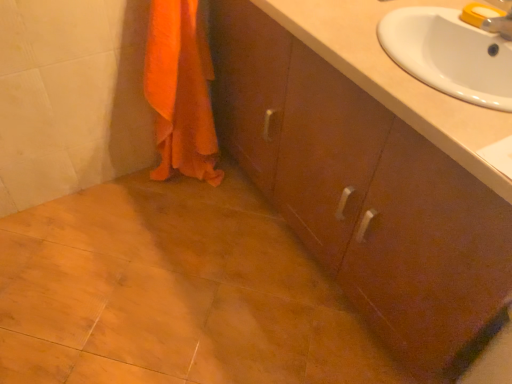
Describe the element at coordinates (181, 91) in the screenshot. The image size is (512, 384). I see `orange fabric towel at lower left` at that location.

The image size is (512, 384). I want to click on white glossy sink at upper right, so (395, 77).

Which of these two, orange fabric towel at lower left or brown wood cabinet at center, is smaller?

With smaller size is orange fabric towel at lower left.

Consider the image. Is orange fabric towel at lower left situated inside brown wood cabinet at center or outside?

orange fabric towel at lower left exists outside the volume of brown wood cabinet at center.

Which object is further away from the camera taking this photo, orange fabric towel at lower left or brown wood cabinet at center?

Positioned behind is orange fabric towel at lower left.

From a real-world perspective, which object rests below the other?

orange fabric towel at lower left.

Can you tell me how much orange fabric towel at lower left and white glossy sink at upper right differ in facing direction?

The angle between the facing direction of orange fabric towel at lower left and the facing direction of white glossy sink at upper right is 90.6 degrees.

Is orange fabric towel at lower left not within white glossy sink at upper right?

Yes.

Is orange fabric towel at lower left not close to white glossy sink at upper right?

That's not correct — orange fabric towel at lower left is a little close to white glossy sink at upper right.

Considering the sizes of objects orange fabric towel at lower left and white glossy sink at upper right in the image provided, who is wider, orange fabric towel at lower left or white glossy sink at upper right?

Wider between the two is white glossy sink at upper right.

Considering the sizes of objects brown wood cabinet at center and white glossy sink at upper right in the image provided, who is thinner, brown wood cabinet at center or white glossy sink at upper right?

white glossy sink at upper right is thinner.

From the picture: Between brown wood cabinet at center and white glossy sink at upper right, which one is positioned in front?

brown wood cabinet at center.

Is brown wood cabinet at center turned away from white glossy sink at upper right?

No, brown wood cabinet at center is not facing away from white glossy sink at upper right.

Is brown wood cabinet at center positioned far away from white glossy sink at upper right?

No, there isn't a large distance between brown wood cabinet at center and white glossy sink at upper right.

How many degrees apart are the facing directions of brown wood cabinet at center and orange fabric towel at lower left?

brown wood cabinet at center and orange fabric towel at lower left are facing 89.5 degrees away from each other.

Is brown wood cabinet at center beside orange fabric towel at lower left?

Result: No, brown wood cabinet at center is not with orange fabric towel at lower left.

Can orange fabric towel at lower left be found inside brown wood cabinet at center?

No.

Consider the image. From the image's perspective, is brown wood cabinet at center located beneath orange fabric towel at lower left?

Indeed, from the image's perspective, brown wood cabinet at center is shown beneath orange fabric towel at lower left.

Where is `counter top below the orange fabric towel at lower left (from the image's perspective)`? This screenshot has width=512, height=384. counter top below the orange fabric towel at lower left (from the image's perspective) is located at coordinates (395, 77).

Could you tell me if white glossy sink at upper right is facing orange fabric towel at lower left?

No, white glossy sink at upper right is not aimed at orange fabric towel at lower left.

Is white glossy sink at upper right situated inside orange fabric towel at lower left or outside?

white glossy sink at upper right exists outside the volume of orange fabric towel at lower left.

Identify the location of bathroom cabinet that appears in front of the white glossy sink at upper right. This screenshot has width=512, height=384. (361, 190).

Is brown wood cabinet at center completely or partially inside white glossy sink at upper right?

No, brown wood cabinet at center is located outside of white glossy sink at upper right.

Is white glossy sink at upper right further to the viewer compared to brown wood cabinet at center?

Yes, it is.

Is white glossy sink at upper right facing towards brown wood cabinet at center?

Yes, white glossy sink at upper right is turned towards brown wood cabinet at center.

At what (x,y) coordinates should I click in order to perform the action: click on bath towel that is above the brown wood cabinet at center (from the image's perspective). Please return your answer as a coordinate pair (x, y). Looking at the image, I should click on (181, 91).

Find the location of a particular element. Image resolution: width=512 pixels, height=384 pixels. counter top positioned vertically above the orange fabric towel at lower left (from a real-world perspective) is located at coordinates (395, 77).

Based on their spatial positions, is orange fabric towel at lower left or brown wood cabinet at center further from white glossy sink at upper right?

orange fabric towel at lower left is further to white glossy sink at upper right.

When comparing their distances from brown wood cabinet at center, does white glossy sink at upper right or orange fabric towel at lower left seem further?

Based on the image, orange fabric towel at lower left appears to be further to brown wood cabinet at center.

Based on their spatial positions, is white glossy sink at upper right or brown wood cabinet at center further from orange fabric towel at lower left?

white glossy sink at upper right lies further to orange fabric towel at lower left than the other object.

Based on their spatial positions, is brown wood cabinet at center or orange fabric towel at lower left further from white glossy sink at upper right?

orange fabric towel at lower left is positioned further to the anchor white glossy sink at upper right.

From the picture: Considering their positions, is brown wood cabinet at center positioned closer to orange fabric towel at lower left than white glossy sink at upper right?

brown wood cabinet at center is closer to orange fabric towel at lower left.

From the image, which object appears to be nearer to brown wood cabinet at center, orange fabric towel at lower left or white glossy sink at upper right?

white glossy sink at upper right is closer to brown wood cabinet at center.

In order to click on bathroom cabinet situated between orange fabric towel at lower left and white glossy sink at upper right from left to right in this screenshot , I will do `click(361, 190)`.